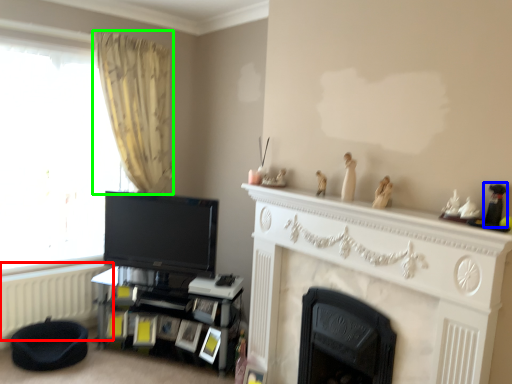
Question: Which is nearer to the radiator (highlighted by a red box)? toy (highlighted by a blue box) or curtain (highlighted by a green box).

Choices:
 (A) toy
 (B) curtain

Answer: (B)